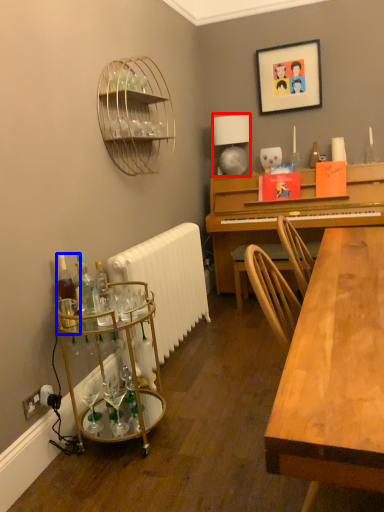
Question: Which object is closer to the camera taking this photo, lamp (highlighted by a red box) or bottle (highlighted by a blue box)?

Choices:
 (A) lamp
 (B) bottle

Answer: (B)